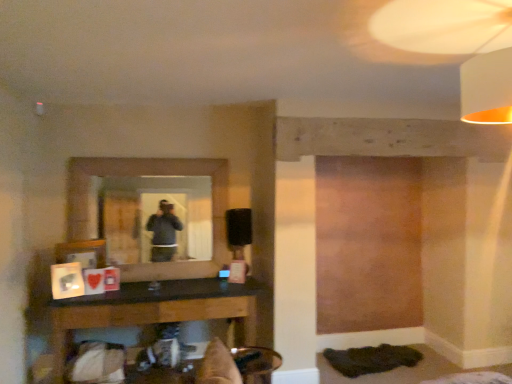
Question: Does white fabric lampshade at upper right lie in front of black wood table at lower center?

Choices:
 (A) yes
 (B) no

Answer: (A)

Question: Can you confirm if white fabric lampshade at upper right is wider than black wood table at lower center?

Choices:
 (A) yes
 (B) no

Answer: (B)

Question: Is white fabric lampshade at upper right facing away from black wood table at lower center?

Choices:
 (A) no
 (B) yes

Answer: (A)

Question: Is the surface of white fabric lampshade at upper right in direct contact with black wood table at lower center?

Choices:
 (A) yes
 (B) no

Answer: (B)

Question: Can you confirm if white fabric lampshade at upper right is taller than black wood table at lower center?

Choices:
 (A) no
 (B) yes

Answer: (A)

Question: Considering the positions of matte glass mirror at center and black wood table at lower center in the image, is matte glass mirror at center wider or thinner than black wood table at lower center?

Choices:
 (A) wide
 (B) thin

Answer: (B)

Question: Based on their sizes in the image, would you say matte glass mirror at center is bigger or smaller than black wood table at lower center?

Choices:
 (A) small
 (B) big

Answer: (A)

Question: Considering their positions, is matte glass mirror at center located in front of or behind black wood table at lower center?

Choices:
 (A) behind
 (B) front

Answer: (A)

Question: From the image's perspective, is matte glass mirror at center located above or below black wood table at lower center?

Choices:
 (A) below
 (B) above

Answer: (B)

Question: Is white fabric lampshade at upper right taller or shorter than black wood table at lower center?

Choices:
 (A) tall
 (B) short

Answer: (B)

Question: From the image's perspective, is white fabric lampshade at upper right positioned above or below black wood table at lower center?

Choices:
 (A) below
 (B) above

Answer: (B)

Question: Is white fabric lampshade at upper right wider or thinner than black wood table at lower center?

Choices:
 (A) wide
 (B) thin

Answer: (B)

Question: Is white fabric lampshade at upper right bigger or smaller than black wood table at lower center?

Choices:
 (A) small
 (B) big

Answer: (A)

Question: From a real-world perspective, relative to matte glass mirror at center, is white fabric lampshade at upper right vertically above or below?

Choices:
 (A) above
 (B) below

Answer: (A)

Question: Is white fabric lampshade at upper right spatially inside matte glass mirror at center, or outside of it?

Choices:
 (A) inside
 (B) outside

Answer: (B)